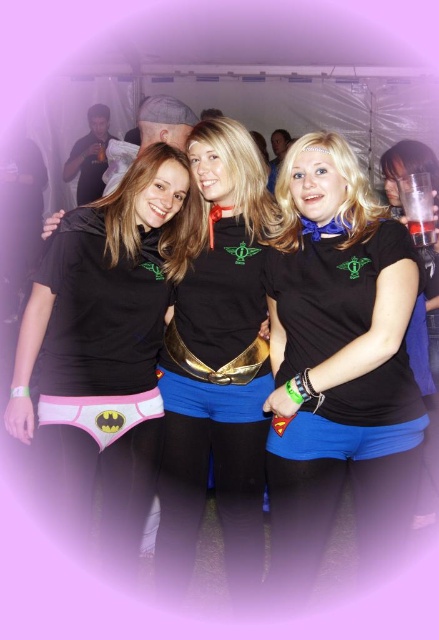
You are a photographer at a themed event. You need to position a spotlight on the blue matte shorts at right and the pink fabric underwear at lower left. Since the spotlight can only cover one object at a time, which object should you aim the spotlight at first if you want to follow the left to right order?

You should aim the spotlight at the pink fabric underwear at lower left first because it is positioned to the left of the blue matte shorts at right.

You are a photographer at a themed event. You need to position a light to the left of the blue matte shorts at center and another light to the right of the matte black shirt at center. Will the two lights be on the same side relative to each other?

The blue matte shorts at center are to the right of the matte black shirt at center. Positioning a light to the left of the blue matte shorts and another to the right of the matte black shirt would place both lights on the left side of the blue matte shorts but not necessarily the same side relative to each other. The light on the right of the matte black shirt could be either left or right of the other light depending on their exact placement.